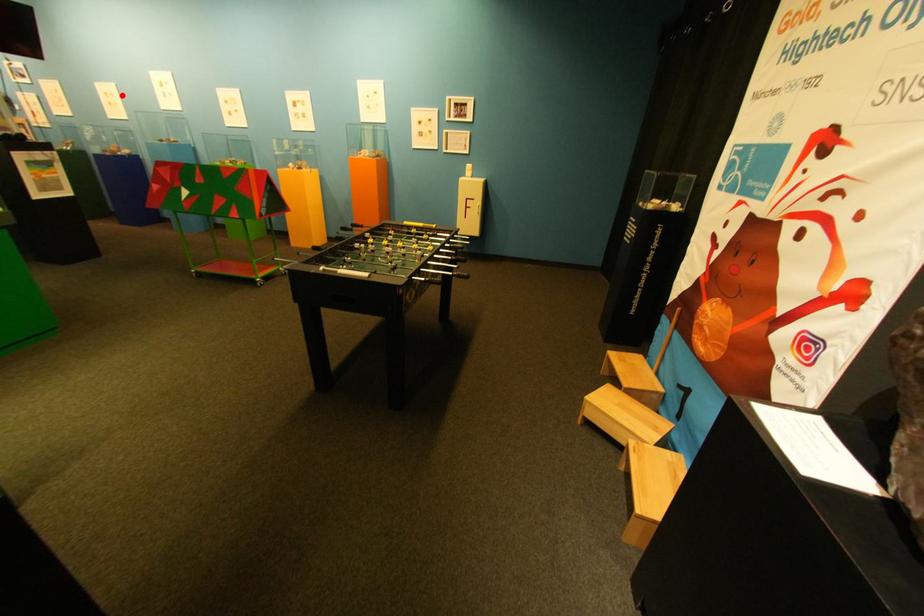
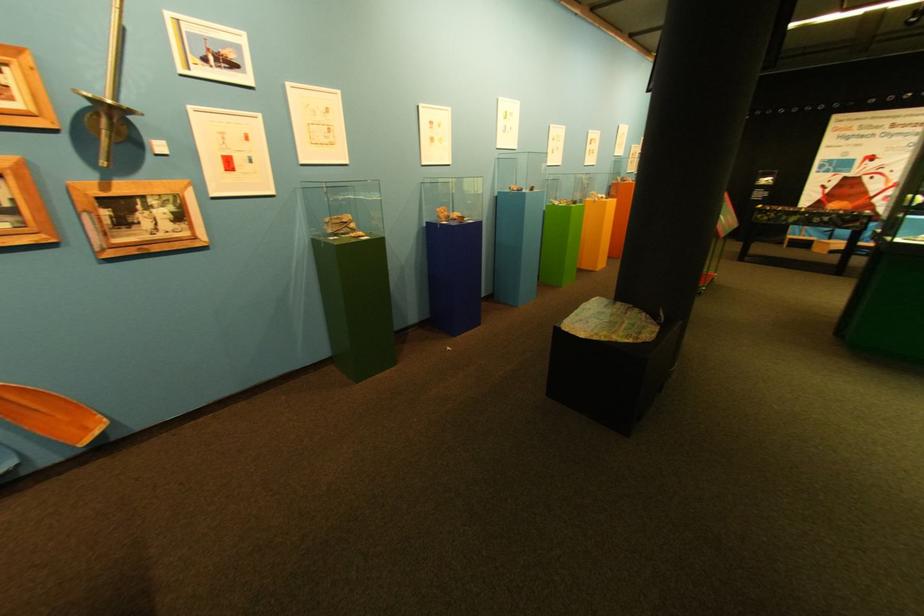
In the second image, find the point that corresponds to the highlighted location in the first image.

(445, 124)